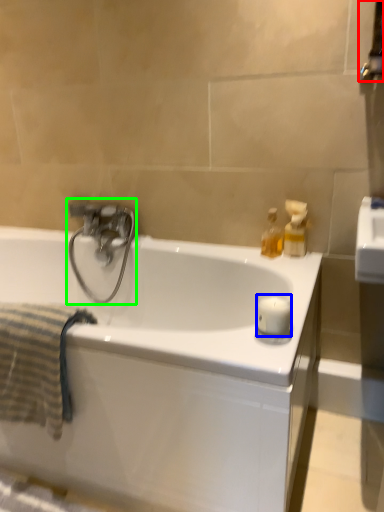
Question: Considering the real-world distances, which object is farthest from towel bar (highlighted by a red box)? candle (highlighted by a blue box) or tap (highlighted by a green box)?

Choices:
 (A) candle
 (B) tap

Answer: (B)